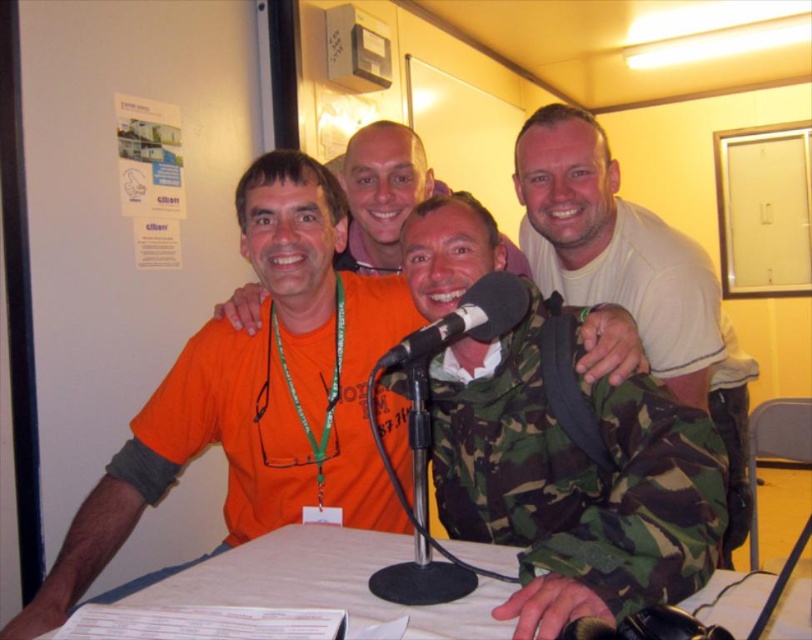
Between camouflage fabric shirt at center and camouflage fabric backpack at right, which one is positioned higher?

camouflage fabric backpack at right is higher up.

Where is `camouflage fabric shirt at center`? Image resolution: width=812 pixels, height=640 pixels. camouflage fabric shirt at center is located at coordinates (573, 484).

Can you confirm if camouflage fabric shirt at center is taller than white paper at center?

Indeed, camouflage fabric shirt at center has a greater height compared to white paper at center.

Which is below, camouflage fabric shirt at center or white paper at center?

white paper at center is below.

Locate an element on the screen. camouflage fabric shirt at center is located at coordinates (573, 484).

The height and width of the screenshot is (640, 812). Find the location of `camouflage fabric shirt at center`. camouflage fabric shirt at center is located at coordinates (573, 484).

Is point (529, 250) positioned in front of point (314, 561)?

No, it is not.

What do you see at coordinates (633, 276) in the screenshot?
I see `camouflage fabric backpack at right` at bounding box center [633, 276].

This screenshot has width=812, height=640. In order to click on camouflage fabric backpack at right in this screenshot , I will do `click(633, 276)`.

This screenshot has height=640, width=812. Find the location of `camouflage fabric backpack at right`. camouflage fabric backpack at right is located at coordinates (633, 276).